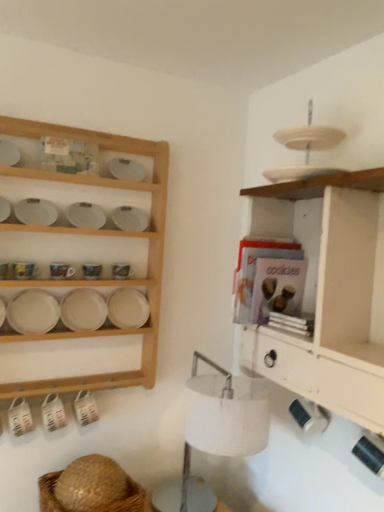
Question: From the image's perspective, is white fabric lampshade at center on white matte platter at left?

Choices:
 (A) yes
 (B) no

Answer: (B)

Question: Is white fabric lampshade at center directly adjacent to white matte platter at left?

Choices:
 (A) no
 (B) yes

Answer: (A)

Question: Is white fabric lampshade at center oriented away from white matte platter at left?

Choices:
 (A) no
 (B) yes

Answer: (A)

Question: From a real-world perspective, is white fabric lampshade at center on top of white matte platter at left?

Choices:
 (A) no
 (B) yes

Answer: (A)

Question: Can you confirm if white fabric lampshade at center is taller than white matte platter at left?

Choices:
 (A) no
 (B) yes

Answer: (B)

Question: Is white fabric lampshade at center thinner than white matte platter at left?

Choices:
 (A) yes
 (B) no

Answer: (B)

Question: Can you confirm if white wood shelf at right, the first shelf viewed from the right, is wider than white fabric lampshade at center?

Choices:
 (A) yes
 (B) no

Answer: (B)

Question: From the image's perspective, does white wood shelf at right, the first shelf viewed from the right, appear higher than white fabric lampshade at center?

Choices:
 (A) no
 (B) yes

Answer: (B)

Question: From the image's perspective, does white wood shelf at right, the second shelf when ordered from left to right, appear lower than white fabric lampshade at center?

Choices:
 (A) no
 (B) yes

Answer: (A)

Question: Does white wood shelf at right, the second shelf when ordered from left to right, lie behind white fabric lampshade at center?

Choices:
 (A) no
 (B) yes

Answer: (A)

Question: Considering the relative sizes of white wood shelf at right, the second shelf when ordered from left to right, and white fabric lampshade at center in the image provided, is white wood shelf at right, the second shelf when ordered from left to right, bigger than white fabric lampshade at center?

Choices:
 (A) yes
 (B) no

Answer: (A)

Question: Is white wood shelf at right, the second shelf when ordered from left to right, next to white fabric lampshade at center?

Choices:
 (A) yes
 (B) no

Answer: (B)

Question: Does brown woven basket at lower left contain white wood shelf at right, the first shelf viewed from the right?

Choices:
 (A) yes
 (B) no

Answer: (B)